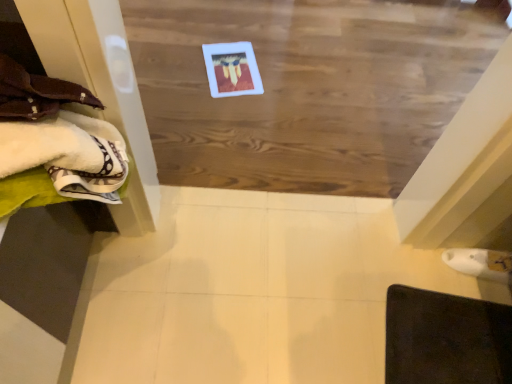
Identify the location of empty space that is ontop of dark brown leather mat at lower right (from a real-world perspective). The height and width of the screenshot is (384, 512). (457, 339).